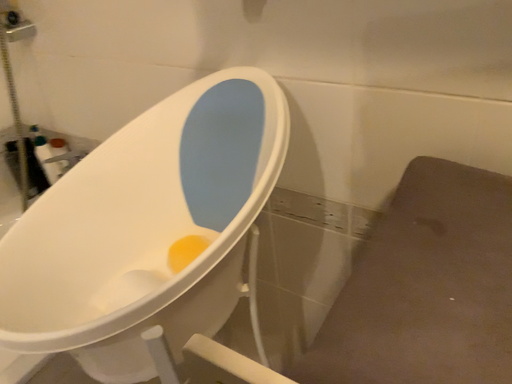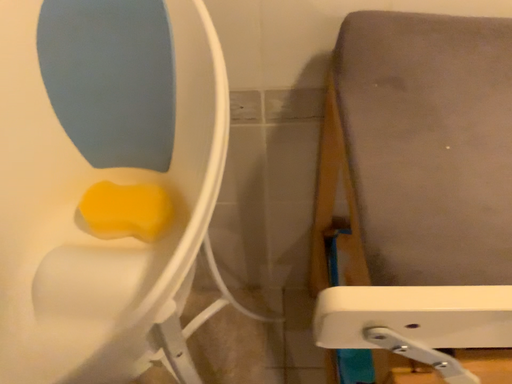
Question: How did the camera likely rotate when shooting the video?

Choices:
 (A) rotated upward
 (B) rotated downward

Answer: (B)